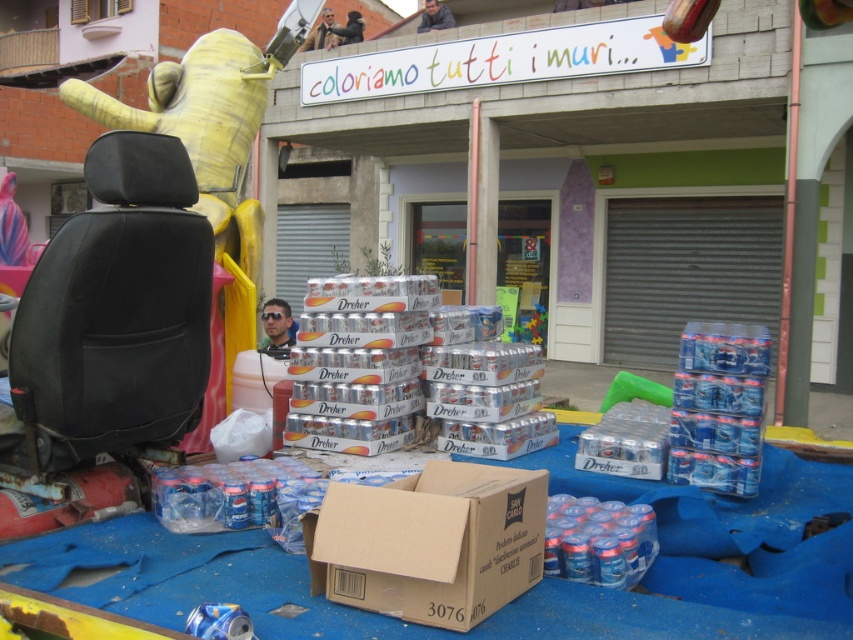
Which is below, black leather seat at left or brown cardboard box at center?

Positioned lower is brown cardboard box at center.

Locate an element on the screen. black leather seat at left is located at coordinates (113, 320).

This screenshot has width=853, height=640. What do you see at coordinates (113, 320) in the screenshot? I see `black leather seat at left` at bounding box center [113, 320].

Where is `black leather seat at left`? black leather seat at left is located at coordinates (113, 320).